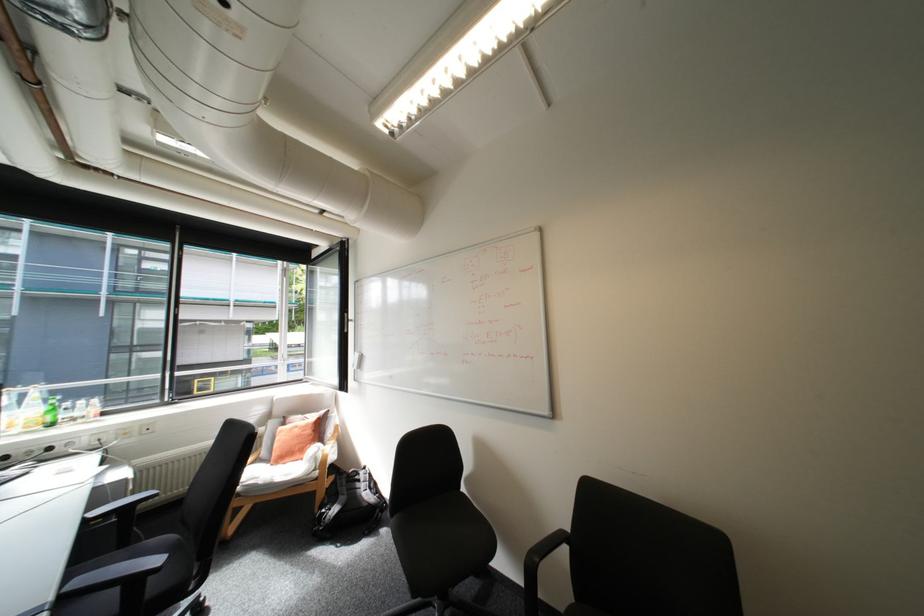
This screenshot has width=924, height=616. Describe the element at coordinates (31, 408) in the screenshot. I see `the clear plastic bottle` at that location.